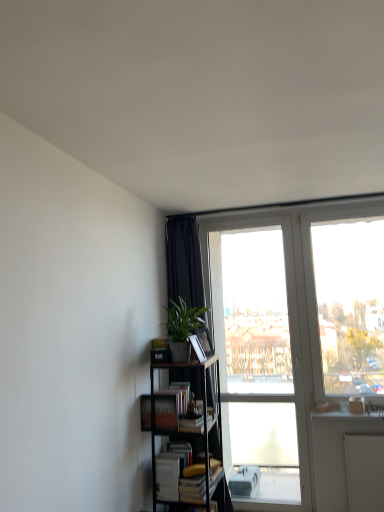
Image resolution: width=384 pixels, height=512 pixels. Describe the element at coordinates (180, 476) in the screenshot. I see `white matte book at lower center, marked as the 2th book in a top-to-bottom arrangement` at that location.

This screenshot has height=512, width=384. I want to click on white matte book at lower center, marked as the 2th book in a top-to-bottom arrangement, so click(x=180, y=476).

In order to face matte black bookshelf at lower left, acting as the first book starting from the top, should I rotate leftwards or rightwards?

Rotate your view left by about 3.128°.

Locate an element on the screen. The height and width of the screenshot is (512, 384). black metal bookcase at lower left is located at coordinates (179, 425).

What do you see at coordinates (184, 261) in the screenshot? This screenshot has height=512, width=384. I see `black fabric curtain at upper left` at bounding box center [184, 261].

Measure the distance between black fabric curtain at upper left and camera.

The depth of black fabric curtain at upper left is 11.15 feet.

What is the approximate width of matte black paperback book at center, the 2th paperback book from the bottom?

matte black paperback book at center, the 2th paperback book from the bottom, is 9.17 centimeters wide.

At what (x,y) coordinates should I click in order to perform the action: click on hardcover book at center, placed as the 1th paperback book when sorted from bottom to top. Please return your answer as a coordinate pair (x, y). Looking at the image, I should click on (192, 418).

Where is `white matte book at lower center, marked as the 2th book in a top-to-bottom arrangement`? white matte book at lower center, marked as the 2th book in a top-to-bottom arrangement is located at coordinates (180, 476).

Is transparent glass door at upper right not within matte black bookshelf at lower left, acting as the first book starting from the top?

Yes, transparent glass door at upper right is not within matte black bookshelf at lower left, acting as the first book starting from the top.

From the image's perspective, is transparent glass door at upper right located beneath matte black bookshelf at lower left, the 2th book when ordered from bottom to top?

No, from the image's perspective, transparent glass door at upper right is not beneath matte black bookshelf at lower left, the 2th book when ordered from bottom to top.

Can you confirm if transparent glass door at upper right is bigger than matte black bookshelf at lower left, the 2th book when ordered from bottom to top?

Yes.

Would you consider transparent glass door at upper right to be distant from black fabric curtain at upper left?

That's right, there is a large distance between transparent glass door at upper right and black fabric curtain at upper left.

Is transparent glass door at upper right positioned before black fabric curtain at upper left?

No, the depth of transparent glass door at upper right is greater than that of black fabric curtain at upper left.

Which is closer, (339, 393) or (203, 304)?

Point (339, 393) is closer to the camera than point (203, 304).

Is transparent glass door at upper right facing away from black fabric curtain at upper left?

transparent glass door at upper right is not turned away from black fabric curtain at upper left.

From the image's perspective, which one is positioned lower, hardcover book at center, the 2th paperback book from the top, or matte black bookshelf at lower left, the 2th book when ordered from bottom to top?

hardcover book at center, the 2th paperback book from the top, is shown below in the image.

From a real-world perspective, which object rests below the other?

hardcover book at center, placed as the 1th paperback book when sorted from bottom to top, is physically lower.

Is hardcover book at center, the 2th paperback book from the top, oriented towards matte black bookshelf at lower left, the 2th book when ordered from bottom to top?

No.

Considering the positions of point (188, 413) and point (170, 417), is point (188, 413) closer or farther from the camera than point (170, 417)?

Point (188, 413) is farther from the camera than point (170, 417).

Between point (330, 374) and point (193, 481), which one is positioned behind?

The point (330, 374) is farther from the camera.

Is transparent glass door at upper right closer to the viewer compared to white matte book at lower center, the first book when ordered from bottom to top?

No, the depth of transparent glass door at upper right is greater than that of white matte book at lower center, the first book when ordered from bottom to top.

Where is `the 1st book to the left when counting from the transparent glass door at upper right`? Image resolution: width=384 pixels, height=512 pixels. the 1st book to the left when counting from the transparent glass door at upper right is located at coordinates (180, 476).

How much distance is there between transparent glass door at upper right and white matte book at lower center, marked as the 2th book in a top-to-bottom arrangement?

4.13 feet.

From a real-world perspective, is white matte book at lower center, marked as the 2th book in a top-to-bottom arrangement, physically above black fabric curtain at upper left?

No.

Which is more to the left, white matte book at lower center, marked as the 2th book in a top-to-bottom arrangement, or black fabric curtain at upper left?

white matte book at lower center, marked as the 2th book in a top-to-bottom arrangement.

Who is taller, white matte book at lower center, the first book when ordered from bottom to top, or black fabric curtain at upper left?

With more height is black fabric curtain at upper left.

Based on their sizes in the image, would you say white matte book at lower center, the first book when ordered from bottom to top, is bigger or smaller than black fabric curtain at upper left?

Considering their sizes, white matte book at lower center, the first book when ordered from bottom to top, takes up less space than black fabric curtain at upper left.

Are matte black bookshelf at lower left, the 2th book when ordered from bottom to top, and black fabric curtain at upper left beside each other?

They are not placed beside each other.

Can you confirm if matte black bookshelf at lower left, the 2th book when ordered from bottom to top, is positioned to the left of black fabric curtain at upper left?

Correct, you'll find matte black bookshelf at lower left, the 2th book when ordered from bottom to top, to the left of black fabric curtain at upper left.

Is point (156, 398) closer to camera compared to point (182, 249)?

Yes.

From the image's perspective, is matte black bookshelf at lower left, acting as the first book starting from the top, below black fabric curtain at upper left?

Yes, from the image's perspective, matte black bookshelf at lower left, acting as the first book starting from the top, is beneath black fabric curtain at upper left.

Can you tell me how much black fabric curtain at upper left and black metal bookcase at lower left differ in facing direction?

The angle between the facing direction of black fabric curtain at upper left and the facing direction of black metal bookcase at lower left is 92.5 degrees.

Is black fabric curtain at upper left far away from black metal bookcase at lower left?

black fabric curtain at upper left is actually quite close to black metal bookcase at lower left.

Is black fabric curtain at upper left smaller than black metal bookcase at lower left?

Actually, black fabric curtain at upper left might be larger than black metal bookcase at lower left.

The width and height of the screenshot is (384, 512). Identify the location of bookcase below the black fabric curtain at upper left (from the image's perspective). (179, 425).

At what (x,y) coordinates should I click in order to perform the action: click on glass door that is above the matte black bookshelf at lower left, acting as the first book starting from the top (from the image's perspective). Please return your answer as a coordinate pair (x, y). Looking at the image, I should click on (341, 394).

This screenshot has width=384, height=512. In order to click on curtain in front of the transparent glass door at upper right in this screenshot , I will do `click(184, 261)`.

Looking at the image, which one is located further to white matte book at lower center, marked as the 2th book in a top-to-bottom arrangement, hardcover book at center, placed as the 1th paperback book when sorted from bottom to top, or transparent glass door at upper right?

transparent glass door at upper right is positioned further to the anchor white matte book at lower center, marked as the 2th book in a top-to-bottom arrangement.

Which object lies nearer to the anchor point white matte book at lower center, marked as the 2th book in a top-to-bottom arrangement, black metal bookcase at lower left or matte black bookshelf at lower left, the 2th book when ordered from bottom to top?

Based on the image, black metal bookcase at lower left appears to be nearer to white matte book at lower center, marked as the 2th book in a top-to-bottom arrangement.

From the image, which object appears to be nearer to green matte plant at center-left, matte black bookshelf at lower left, acting as the first book starting from the top, or white matte book at lower center, marked as the 2th book in a top-to-bottom arrangement?

matte black bookshelf at lower left, acting as the first book starting from the top, is closer to green matte plant at center-left.

Which object lies nearer to the anchor point matte black paperback book at center, marked as the first paperback book in a top-to-bottom arrangement, black fabric curtain at upper left or hardcover book at center, placed as the 1th paperback book when sorted from bottom to top?

hardcover book at center, placed as the 1th paperback book when sorted from bottom to top, lies closer to matte black paperback book at center, marked as the first paperback book in a top-to-bottom arrangement, than the other object.

From the image, which object appears to be farther from green matte plant at center-left, black metal bookcase at lower left or matte black bookshelf at lower left, acting as the first book starting from the top?

matte black bookshelf at lower left, acting as the first book starting from the top, is further to green matte plant at center-left.

Based on their spatial positions, is transparent glass door at upper right or black metal bookcase at lower left closer to matte black paperback book at center, marked as the first paperback book in a top-to-bottom arrangement?

The object closer to matte black paperback book at center, marked as the first paperback book in a top-to-bottom arrangement, is black metal bookcase at lower left.

Looking at the image, which one is located further to hardcover book at center, the 2th paperback book from the top, black metal bookcase at lower left or black fabric curtain at upper left?

black fabric curtain at upper left is further to hardcover book at center, the 2th paperback book from the top.

From the image, which object appears to be nearer to white matte book at lower center, marked as the 2th book in a top-to-bottom arrangement, matte black paperback book at center, marked as the first paperback book in a top-to-bottom arrangement, or hardcover book at center, the 2th paperback book from the top?

Based on the image, hardcover book at center, the 2th paperback book from the top, appears to be nearer to white matte book at lower center, marked as the 2th book in a top-to-bottom arrangement.

Identify the location of houseplant situated between matte black bookshelf at lower left, the 2th book when ordered from bottom to top, and transparent glass door at upper right from left to right. click(182, 328).

Locate an element on the screen. This screenshot has height=512, width=384. book between green matte plant at center-left and white matte book at lower center, marked as the 2th book in a top-to-bottom arrangement, in the vertical direction is located at coordinates (177, 410).

Locate an element on the screen. The height and width of the screenshot is (512, 384). paperback book between black fabric curtain at upper left and white matte book at lower center, the first book when ordered from bottom to top, vertically is located at coordinates (192, 418).

I want to click on book between matte black paperback book at center, marked as the first paperback book in a top-to-bottom arrangement, and black metal bookcase at lower left vertically, so click(177, 410).